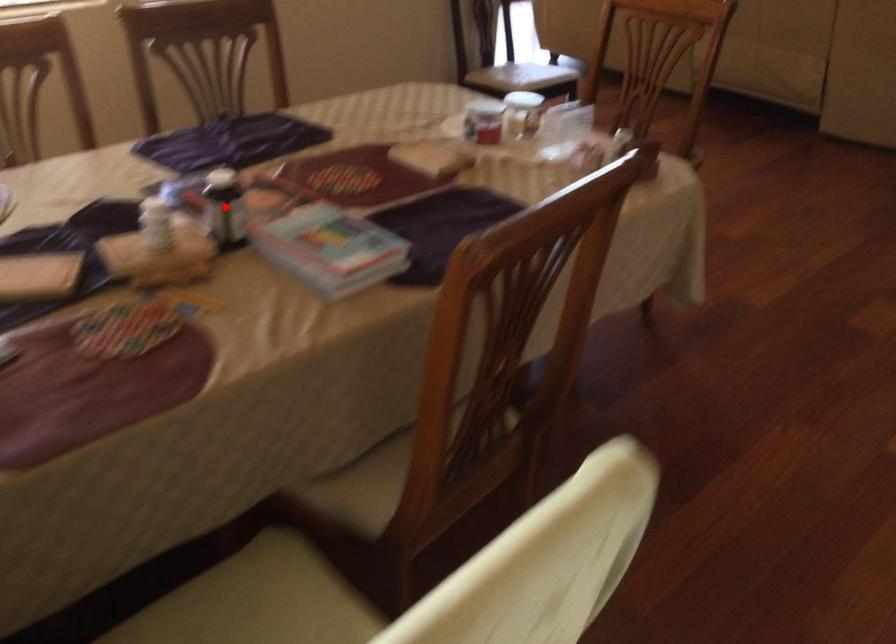
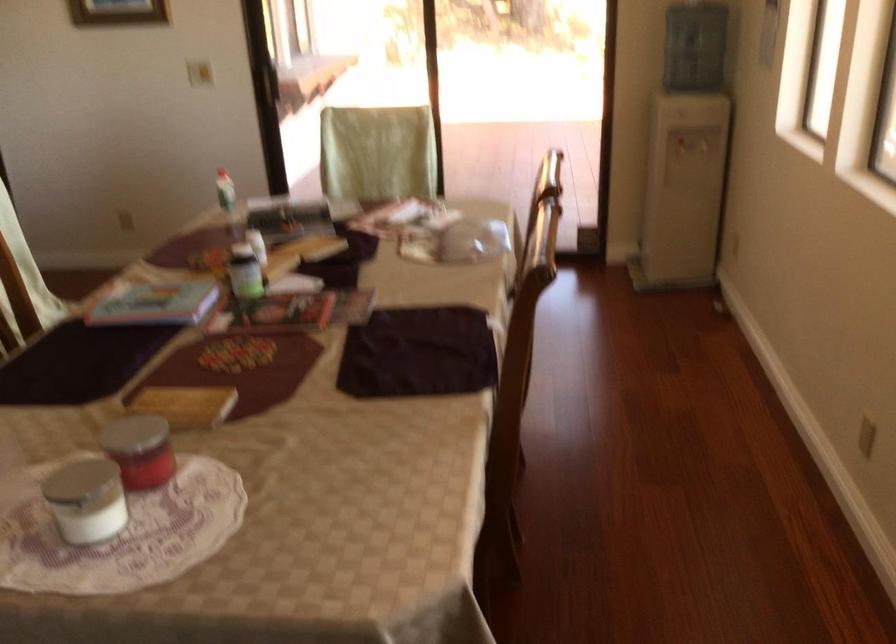
Question: I am providing you with two images of the same scene from different viewpoints. Given a red point in image1, look at the same physical point in image2. Is it:

Choices:
 (A) Closer to the viewpoint
 (B) Farther from the viewpoint

Answer: (B)